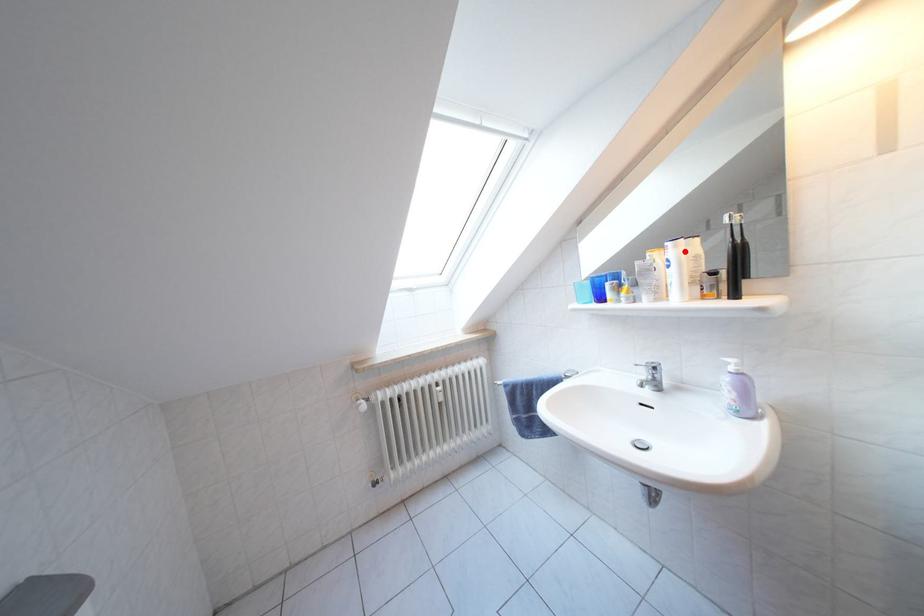
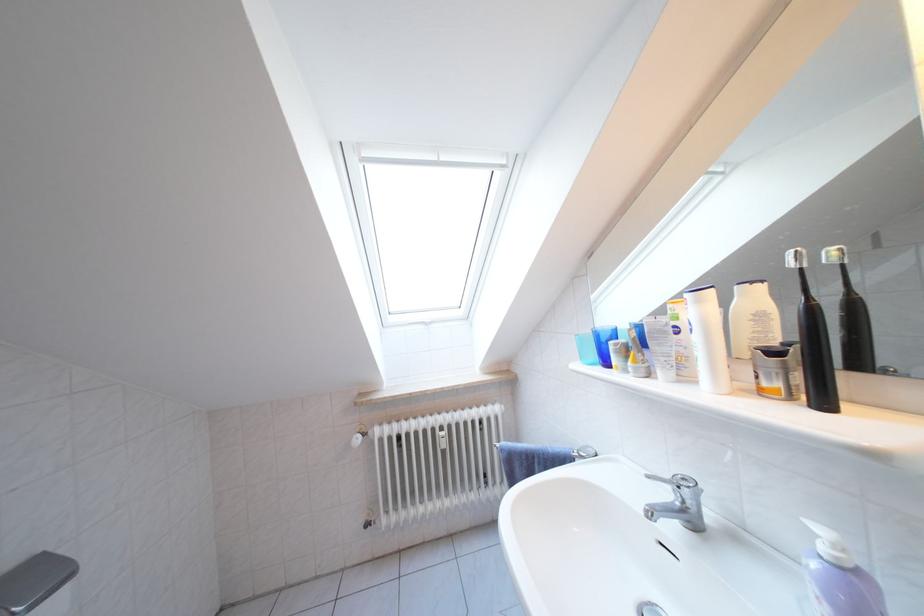
The point at the highlighted location is marked in the first image. Where is the corresponding point in the second image?

(708, 306)